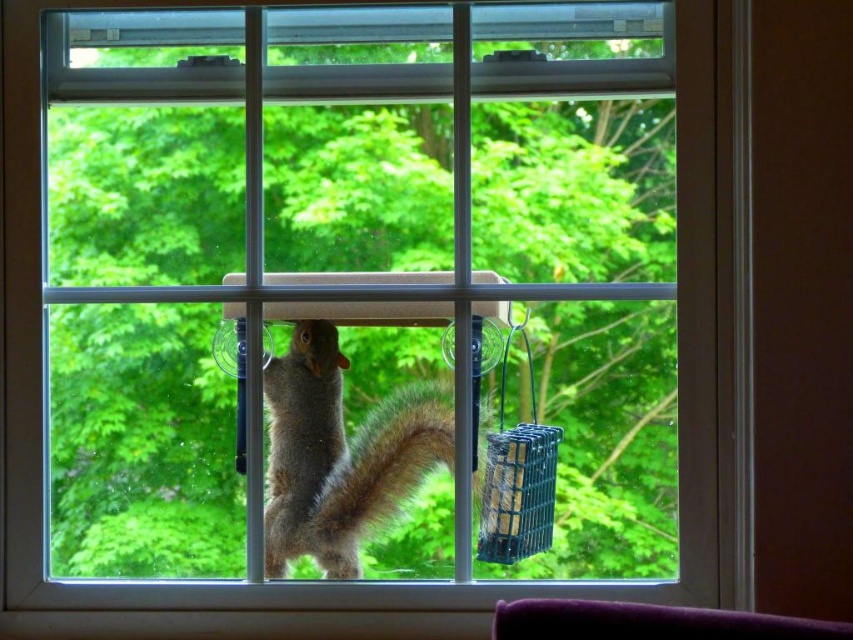
Does fuzzy brown squirrel at center appear over green plastic bird feeder at right?

No, fuzzy brown squirrel at center is not above green plastic bird feeder at right.

Measure the distance between point (277, 474) and camera.

Point (277, 474) is 1.45 meters from camera.

What do you see at coordinates (340, 454) in the screenshot? This screenshot has height=640, width=853. I see `fuzzy brown squirrel at center` at bounding box center [340, 454].

Find the location of `fuzzy brown squirrel at center`. fuzzy brown squirrel at center is located at coordinates (340, 454).